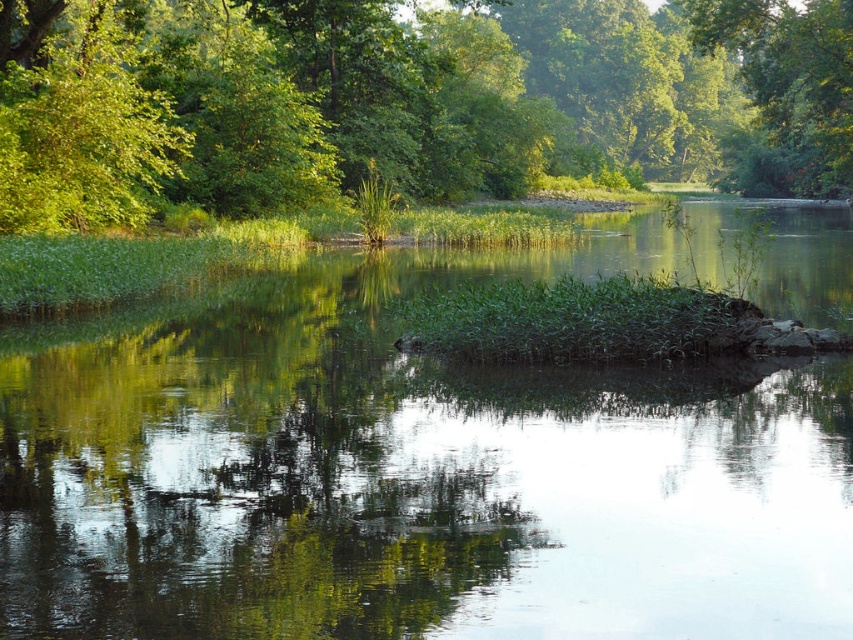
Question: Which of these objects is positioned farthest from the green leafy tree at upper center?

Choices:
 (A) green leafy tree at upper right
 (B) transparent water at center

Answer: (B)

Question: Observing the image, what is the correct spatial positioning of green leafy tree at upper left in reference to green leafy tree at upper right?

Choices:
 (A) below
 (B) above

Answer: (A)

Question: Which of the following is the farthest from the observer?

Choices:
 (A) green leafy tree at upper right
 (B) green leafy tree at upper left
 (C) green leafy tree at upper center

Answer: (A)

Question: Is transparent water at center thinner than green leafy tree at upper center?

Choices:
 (A) no
 (B) yes

Answer: (B)

Question: Does transparent water at center have a lesser width compared to green leafy tree at upper center?

Choices:
 (A) no
 (B) yes

Answer: (B)

Question: Among these points, which one is nearest to the camera?

Choices:
 (A) (788, 147)
 (B) (86, 221)
 (C) (811, 577)

Answer: (C)